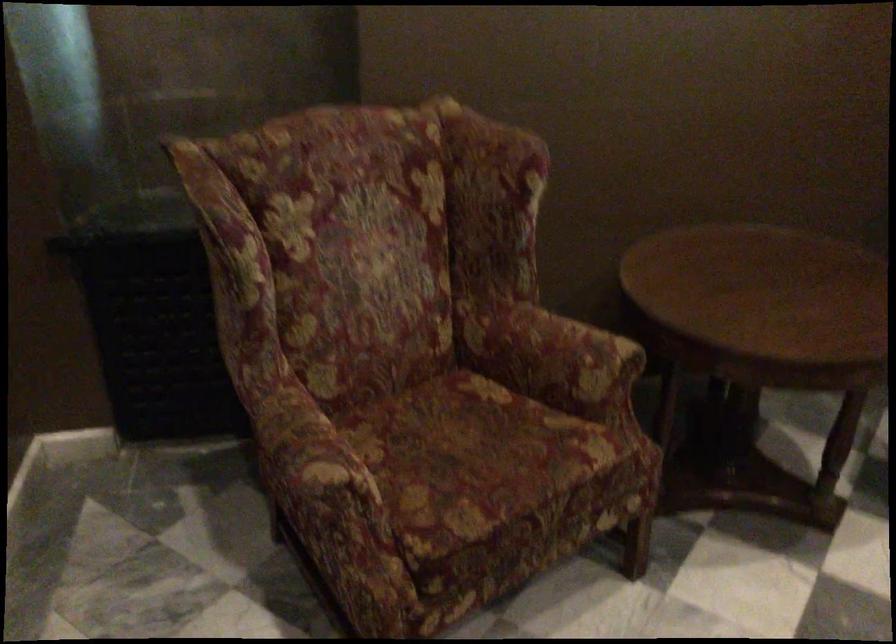
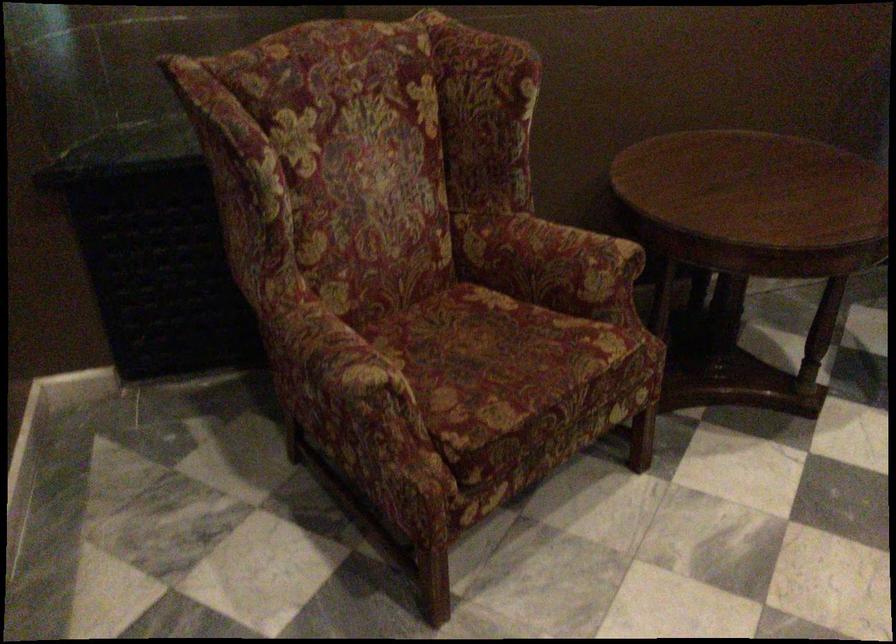
Locate, in the second image, the point that corresponds to the point at 570,352 in the first image.

(572, 256)